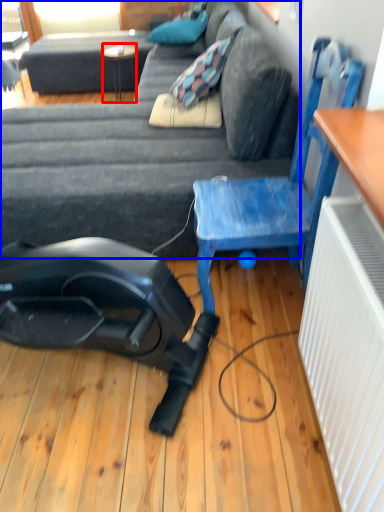
Question: Among these objects, which one is nearest to the camera, table (highlighted by a red box) or studio couch (highlighted by a blue box)?

Choices:
 (A) table
 (B) studio couch

Answer: (B)